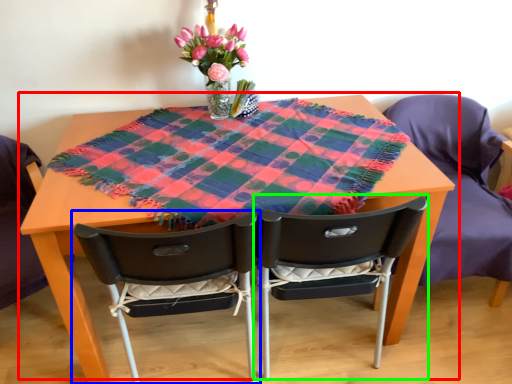
Question: Considering the real-world distances, which object is farthest from table (highlighted by a red box)? chair (highlighted by a blue box) or chair (highlighted by a green box)?

Choices:
 (A) chair
 (B) chair

Answer: (B)